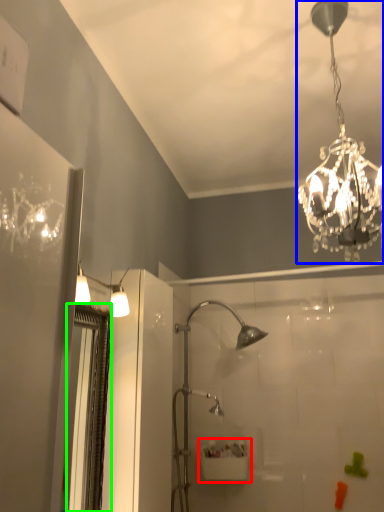
Question: Estimate the real-world distances between objects in this image. Which object is farther from sink (highlighted by a red box), lamp (highlighted by a blue box) or screen door (highlighted by a green box)?

Choices:
 (A) lamp
 (B) screen door

Answer: (A)